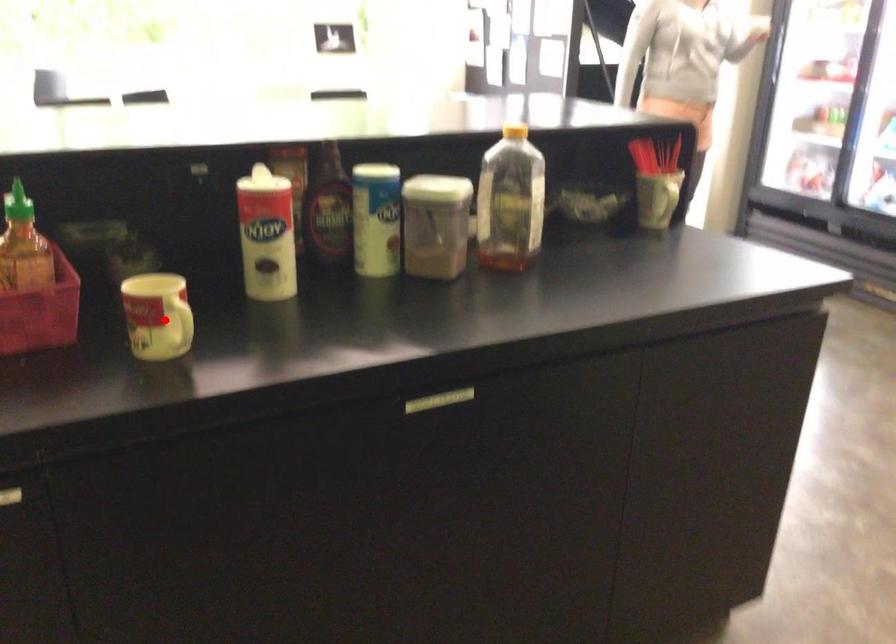
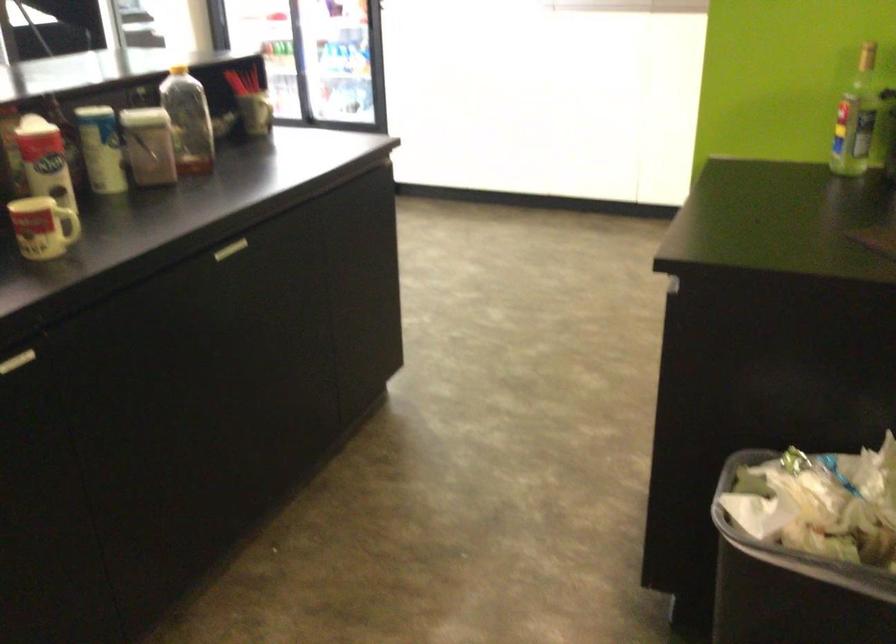
Find the pixel in the second image that matches the highlighted location in the first image.

(66, 225)